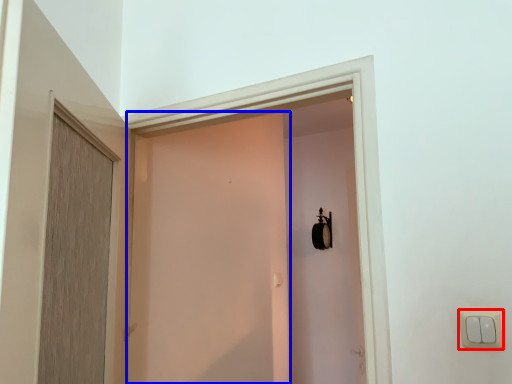
Question: Which object is closer to the camera taking this photo, light switch (highlighted by a red box) or screen door (highlighted by a blue box)?

Choices:
 (A) light switch
 (B) screen door

Answer: (A)